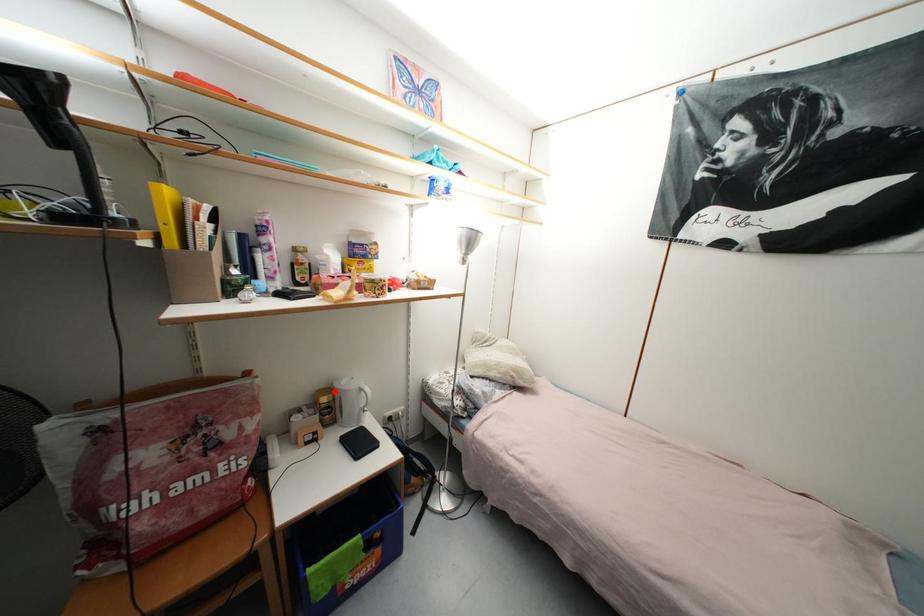
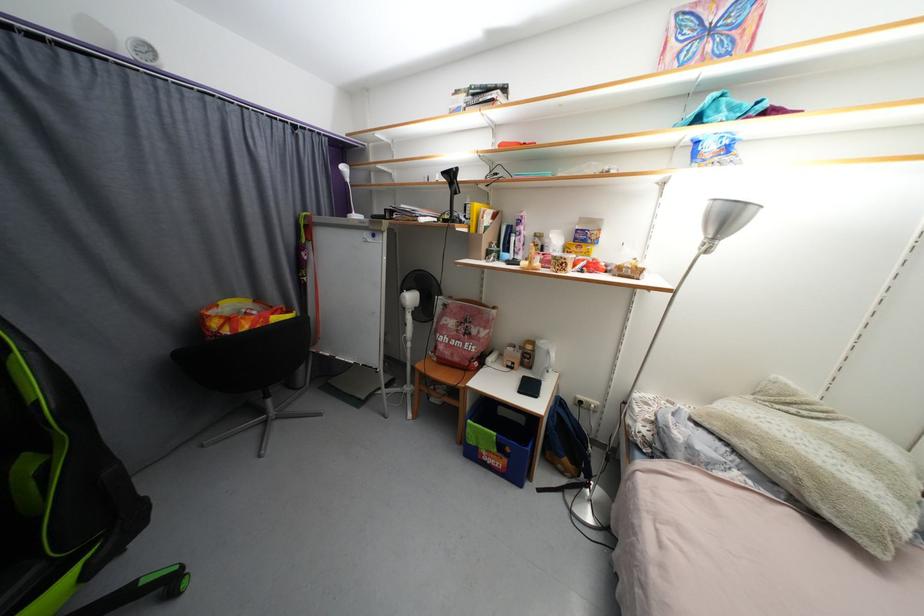
In the second image, find the point that corresponds to the highlighted location in the first image.

(538, 344)